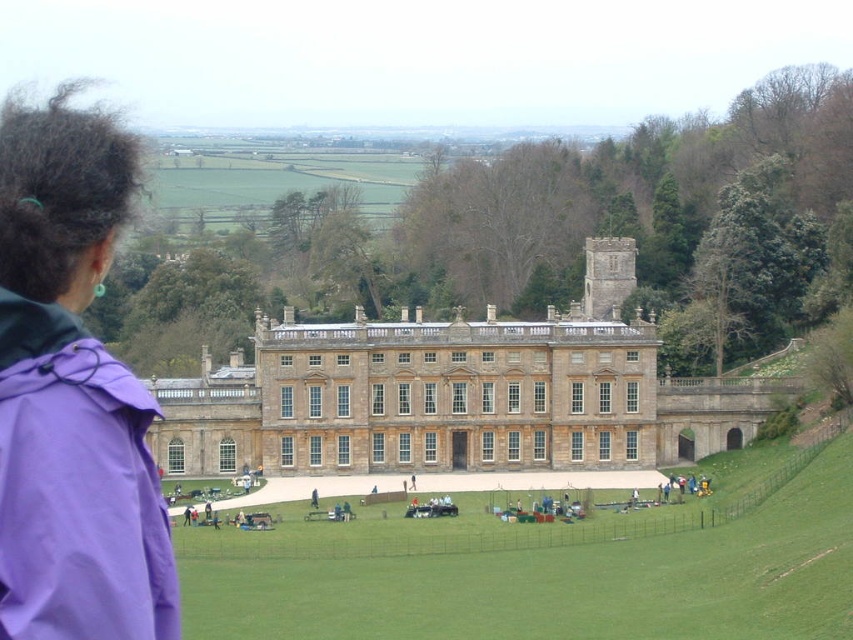
You are planning to take a photo of the light brown stone palace at center and the purple fabric at left. Which object should you focus on first if you want to capture both in a single frame without moving the camera?

You should focus on the light brown stone palace at center first because it is wider than the purple fabric at left, so positioning it properly will ensure both fit in the frame.

You are planning to take a photo of the light brown stone palace at center and the purple fabric at left. Which object should you focus on first if you want to capture both in a single frame without moving the camera?

The light brown stone palace at center is smaller than the purple fabric at left, so you should focus on the purple fabric at left first to ensure it fits within the frame.

You are standing on the lawn in front of the light brown stone palace at center and want to walk towards the purple fabric at left. Which direction should you face?

You should face to the left because the light brown stone palace at center is to the right of the purple fabric at left, so walking towards the left will lead you toward the purple fabric at left.